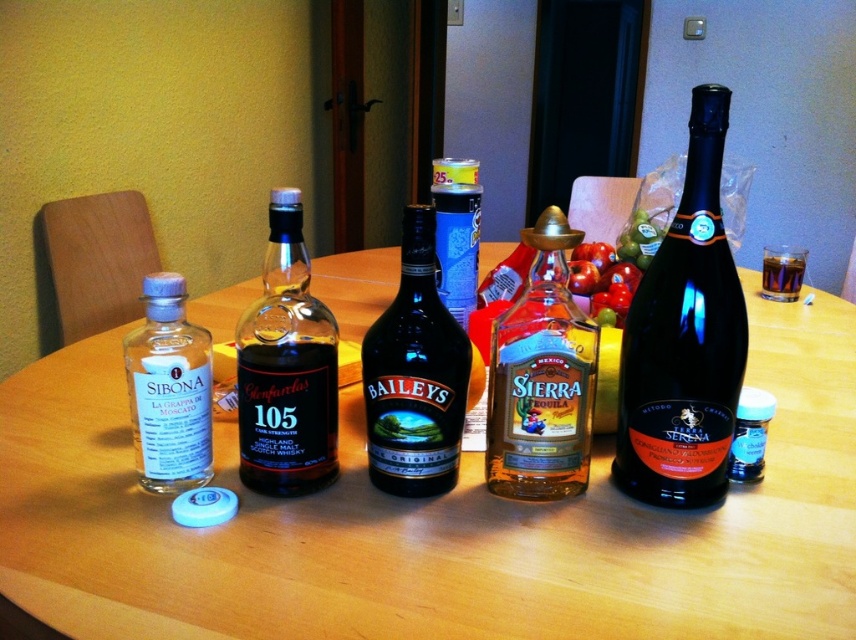
Question: Is blue glass bottle at right below dark brown liquid at center?

Choices:
 (A) no
 (B) yes

Answer: (B)

Question: Can you confirm if wooden table at center is positioned below blue glass bottle at right?

Choices:
 (A) yes
 (B) no

Answer: (B)

Question: Is blue glass bottle at right positioned before dark brown liquid at center?

Choices:
 (A) yes
 (B) no

Answer: (A)

Question: Which point is closer to the camera?

Choices:
 (A) (97, 497)
 (B) (189, 346)
 (C) (693, 237)
 (D) (738, 400)

Answer: (C)

Question: Among these objects, which one is farthest from the camera?

Choices:
 (A) translucent glass tequila at center
 (B) black glass champagne at right
 (C) black glass bottle at center

Answer: (C)

Question: Considering the real-world distances, which object is farthest from the translucent glass tequila at center?

Choices:
 (A) black glass champagne at right
 (B) dark brown liquid at center

Answer: (B)